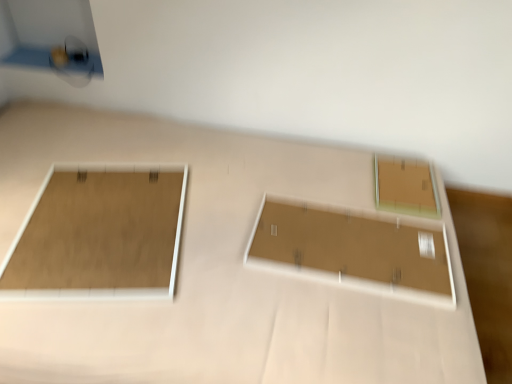
What is the approximate width of matte brown board at center, arranged as the second rectangle when viewed from the right?

matte brown board at center, arranged as the second rectangle when viewed from the right, is 26.15 inches in width.

Describe the element at coordinates (99, 235) in the screenshot. I see `matte brown frame at left, which ranks as the 1th rectangle in left-to-right order` at that location.

The image size is (512, 384). Find the location of `matte brown board at center, arranged as the second rectangle when viewed from the right`. matte brown board at center, arranged as the second rectangle when viewed from the right is located at coordinates (353, 250).

Which is correct: matte brown frame at upper right, acting as the first rectangle starting from the right, is inside matte brown board at center, arranged as the second rectangle when viewed from the right, or outside of it?

matte brown frame at upper right, acting as the first rectangle starting from the right, is outside matte brown board at center, arranged as the second rectangle when viewed from the right.

Does matte brown frame at upper right, acting as the first rectangle starting from the right, turn towards matte brown board at center, the second rectangle when ordered from left to right?

Yes.

Is matte brown frame at upper right, marked as the third rectangle in a left-to-right arrangement, smaller than matte brown board at center, arranged as the second rectangle when viewed from the right?

Yes.

From the image's perspective, is matte brown frame at upper right, acting as the first rectangle starting from the right, located above or below matte brown board at center, arranged as the second rectangle when viewed from the right?

matte brown frame at upper right, acting as the first rectangle starting from the right, is situated higher than matte brown board at center, arranged as the second rectangle when viewed from the right, in the image.

From a real-world perspective, count 2nd rectangles downward from the matte brown frame at left, which ranks as the 1th rectangle in left-to-right order, and point to it. Please provide its 2D coordinates.

[(353, 250)]

Would you say matte brown board at center, arranged as the second rectangle when viewed from the right, is inside or outside matte brown frame at left, which ranks as the 1th rectangle in left-to-right order?

matte brown board at center, arranged as the second rectangle when viewed from the right, lies outside matte brown frame at left, which ranks as the 1th rectangle in left-to-right order.

Does matte brown board at center, arranged as the second rectangle when viewed from the right, have a greater width compared to matte brown frame at left, the third rectangle positioned from the right?

Yes, matte brown board at center, arranged as the second rectangle when viewed from the right, is wider than matte brown frame at left, the third rectangle positioned from the right.

How distant is matte brown frame at left, the third rectangle positioned from the right, from matte brown frame at upper right, marked as the third rectangle in a left-to-right arrangement?

matte brown frame at left, the third rectangle positioned from the right, is 94.92 centimeters away from matte brown frame at upper right, marked as the third rectangle in a left-to-right arrangement.

From the image's perspective, which is above, matte brown frame at left, the third rectangle positioned from the right, or matte brown frame at upper right, marked as the third rectangle in a left-to-right arrangement?

matte brown frame at upper right, marked as the third rectangle in a left-to-right arrangement, from the image's perspective.

Between matte brown frame at left, which ranks as the 1th rectangle in left-to-right order, and matte brown frame at upper right, acting as the first rectangle starting from the right, which one is positioned behind?

matte brown frame at upper right, acting as the first rectangle starting from the right, is more distant.

Can you confirm if matte brown frame at left, which ranks as the 1th rectangle in left-to-right order, is smaller than matte brown frame at upper right, marked as the third rectangle in a left-to-right arrangement?

No, matte brown frame at left, which ranks as the 1th rectangle in left-to-right order, is not smaller than matte brown frame at upper right, marked as the third rectangle in a left-to-right arrangement.

Considering the relative sizes of matte brown board at center, the second rectangle when ordered from left to right, and matte brown frame at upper right, acting as the first rectangle starting from the right, in the image provided, is matte brown board at center, the second rectangle when ordered from left to right, thinner than matte brown frame at upper right, acting as the first rectangle starting from the right,?

Incorrect, the width of matte brown board at center, the second rectangle when ordered from left to right, is not less than that of matte brown frame at upper right, acting as the first rectangle starting from the right.

From a real-world perspective, is matte brown board at center, arranged as the second rectangle when viewed from the right, positioned above or below matte brown frame at upper right, marked as the third rectangle in a left-to-right arrangement?

matte brown board at center, arranged as the second rectangle when viewed from the right, is below matte brown frame at upper right, marked as the third rectangle in a left-to-right arrangement.

Is matte brown frame at left, which ranks as the 1th rectangle in left-to-right order, with matte brown board at center, the second rectangle when ordered from left to right?

matte brown frame at left, which ranks as the 1th rectangle in left-to-right order, and matte brown board at center, the second rectangle when ordered from left to right, are clearly separated.

Is matte brown frame at left, the third rectangle positioned from the right, positioned in front of matte brown board at center, the second rectangle when ordered from left to right?

Yes, matte brown frame at left, the third rectangle positioned from the right, is closer to the viewer.

Looking at this image, is matte brown board at center, arranged as the second rectangle when viewed from the right, a part of matte brown frame at left, which ranks as the 1th rectangle in left-to-right order?

No, matte brown frame at left, which ranks as the 1th rectangle in left-to-right order, does not contain matte brown board at center, arranged as the second rectangle when viewed from the right.

Could you measure the distance between matte brown frame at left, which ranks as the 1th rectangle in left-to-right order, and matte brown board at center, the second rectangle when ordered from left to right?

matte brown frame at left, which ranks as the 1th rectangle in left-to-right order, and matte brown board at center, the second rectangle when ordered from left to right, are 53.88 centimeters apart.

Is matte brown frame at upper right, marked as the third rectangle in a left-to-right arrangement, turned away from matte brown frame at left, which ranks as the 1th rectangle in left-to-right order?

No, matte brown frame at upper right, marked as the third rectangle in a left-to-right arrangement, is not facing away from matte brown frame at left, which ranks as the 1th rectangle in left-to-right order.

Based on the photo, is matte brown frame at left, which ranks as the 1th rectangle in left-to-right order, a part of matte brown frame at upper right, marked as the third rectangle in a left-to-right arrangement?

No, matte brown frame at upper right, marked as the third rectangle in a left-to-right arrangement, does not contain matte brown frame at left, which ranks as the 1th rectangle in left-to-right order.

How much distance is there between matte brown frame at upper right, marked as the third rectangle in a left-to-right arrangement, and matte brown frame at left, the third rectangle positioned from the right?

matte brown frame at upper right, marked as the third rectangle in a left-to-right arrangement, is 37.37 inches from matte brown frame at left, the third rectangle positioned from the right.

From the image's perspective, is matte brown frame at upper right, marked as the third rectangle in a left-to-right arrangement, positioned above or below matte brown frame at left, the third rectangle positioned from the right?

matte brown frame at upper right, marked as the third rectangle in a left-to-right arrangement, is situated higher than matte brown frame at left, the third rectangle positioned from the right, in the image.

From a real-world perspective, which rectangle is the 1st one above the matte brown board at center, the second rectangle when ordered from left to right? Please provide its 2D coordinates.

[(406, 187)]

I want to click on rectangle lying below the matte brown frame at left, the third rectangle positioned from the right (from the image's perspective), so click(353, 250).

Based on the photo, considering their positions, is matte brown frame at upper right, acting as the first rectangle starting from the right, positioned further to matte brown board at center, the second rectangle when ordered from left to right, than matte brown frame at left, which ranks as the 1th rectangle in left-to-right order?

matte brown frame at left, which ranks as the 1th rectangle in left-to-right order, lies further to matte brown board at center, the second rectangle when ordered from left to right, than the other object.

Which object lies nearer to the anchor point matte brown frame at upper right, acting as the first rectangle starting from the right, matte brown frame at left, which ranks as the 1th rectangle in left-to-right order, or matte brown board at center, arranged as the second rectangle when viewed from the right?

The object closer to matte brown frame at upper right, acting as the first rectangle starting from the right, is matte brown board at center, arranged as the second rectangle when viewed from the right.

Which object lies nearer to the anchor point matte brown board at center, arranged as the second rectangle when viewed from the right, matte brown frame at left, the third rectangle positioned from the right, or matte brown frame at upper right, marked as the third rectangle in a left-to-right arrangement?

matte brown frame at upper right, marked as the third rectangle in a left-to-right arrangement, is positioned closer to the anchor matte brown board at center, arranged as the second rectangle when viewed from the right.

Based on their spatial positions, is matte brown frame at upper right, marked as the third rectangle in a left-to-right arrangement, or matte brown board at center, arranged as the second rectangle when viewed from the right, closer to matte brown frame at left, which ranks as the 1th rectangle in left-to-right order?

matte brown board at center, arranged as the second rectangle when viewed from the right, is closer to matte brown frame at left, which ranks as the 1th rectangle in left-to-right order.

When comparing their distances from matte brown frame at upper right, acting as the first rectangle starting from the right, does matte brown board at center, arranged as the second rectangle when viewed from the right, or matte brown frame at left, the third rectangle positioned from the right, seem closer?

matte brown board at center, arranged as the second rectangle when viewed from the right.

Looking at the image, which one is located further to matte brown frame at left, the third rectangle positioned from the right, matte brown board at center, arranged as the second rectangle when viewed from the right, or matte brown frame at upper right, marked as the third rectangle in a left-to-right arrangement?

Based on the image, matte brown frame at upper right, marked as the third rectangle in a left-to-right arrangement, appears to be further to matte brown frame at left, the third rectangle positioned from the right.

Image resolution: width=512 pixels, height=384 pixels. Find the location of `rectangle between matte brown frame at left, which ranks as the 1th rectangle in left-to-right order, and matte brown frame at upper right, acting as the first rectangle starting from the right, from left to right`. rectangle between matte brown frame at left, which ranks as the 1th rectangle in left-to-right order, and matte brown frame at upper right, acting as the first rectangle starting from the right, from left to right is located at coordinates (353, 250).